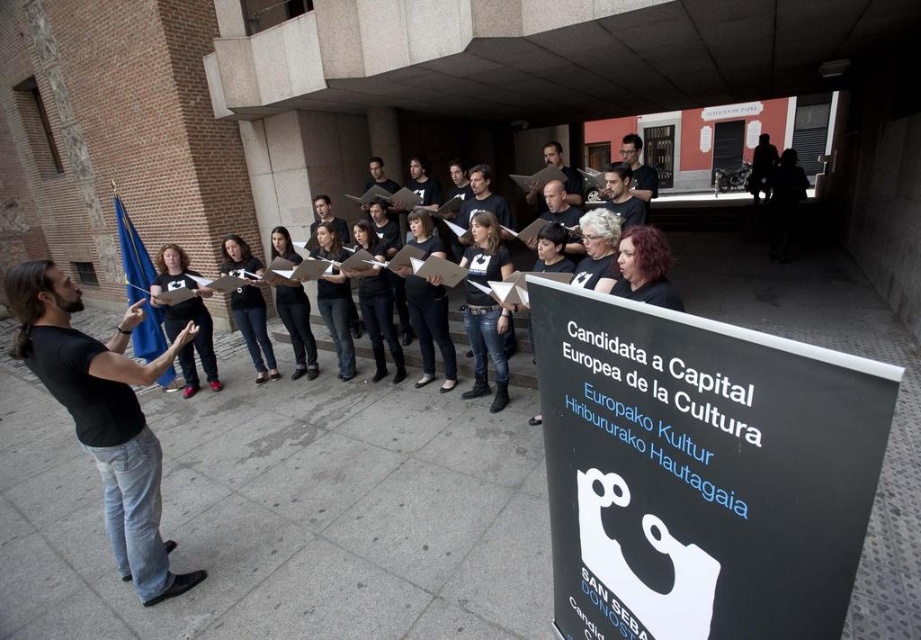
Question: Considering the relative positions of black matte sign at lower right and black fabric shirt at center in the image provided, where is black matte sign at lower right located with respect to black fabric shirt at center?

Choices:
 (A) below
 (B) above

Answer: (A)

Question: Among these points, which one is farthest from the camera?

Choices:
 (A) [633, 456]
 (B) [183, 573]
 (C) [181, 259]

Answer: (C)

Question: Does black matte sign at lower right have a greater width compared to black cotton shirt at left?

Choices:
 (A) no
 (B) yes

Answer: (A)

Question: Does black matte t-shirt at center appear on the left side of matte black shirt at center?

Choices:
 (A) yes
 (B) no

Answer: (B)

Question: Which of these objects is positioned farthest from the black matte sign at lower right?

Choices:
 (A) black matte t-shirt at center
 (B) black cotton shirt at left

Answer: (B)

Question: Estimate the real-world distances between objects in this image. Which object is farther from the black matte sign at lower right?

Choices:
 (A) black matte t-shirt at center
 (B) black fabric shirt at center
 (C) black cotton shirt at left
 (D) matte black shirt at center

Answer: (D)